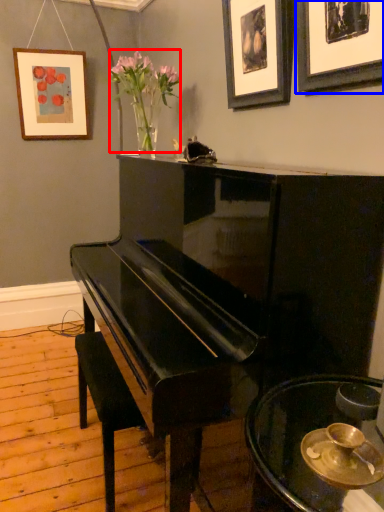
Question: Among these objects, which one is farthest to the camera, floral arrangement (highlighted by a red box) or picture frame (highlighted by a blue box)?

Choices:
 (A) floral arrangement
 (B) picture frame

Answer: (A)